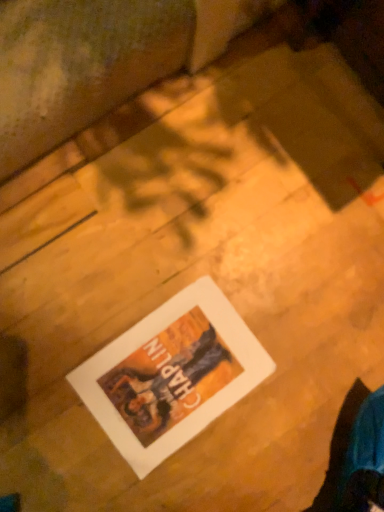
Question: Should I look upward or downward to see matte paper poster at center?

Choices:
 (A) up
 (B) down

Answer: (B)